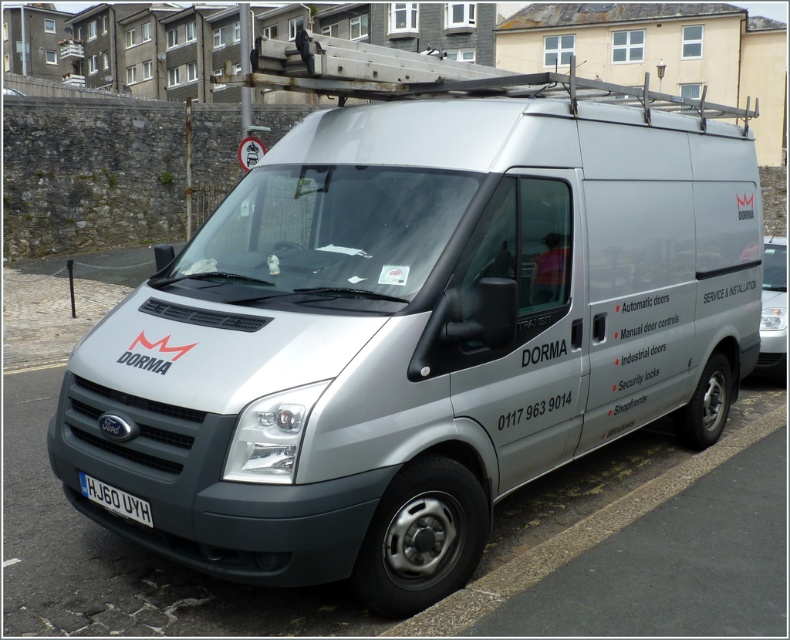
Question: Among these points, which one is farthest from the camera?

Choices:
 (A) (512, 592)
 (B) (125, 492)

Answer: (A)

Question: Which of the following is the farthest from the observer?

Choices:
 (A) gray asphalt curb at lower right
 (B) white plastic license plate at lower center

Answer: (A)

Question: Observing the image, what is the correct spatial positioning of gray asphalt curb at lower right in reference to white plastic license plate at lower center?

Choices:
 (A) left
 (B) right

Answer: (B)

Question: Among these points, which one is nearest to the camera?

Choices:
 (A) (570, 545)
 (B) (102, 500)

Answer: (B)

Question: Does gray asphalt curb at lower right appear over white plastic license plate at lower center?

Choices:
 (A) no
 (B) yes

Answer: (A)

Question: Does gray asphalt curb at lower right have a greater width compared to white plastic license plate at lower center?

Choices:
 (A) yes
 (B) no

Answer: (A)